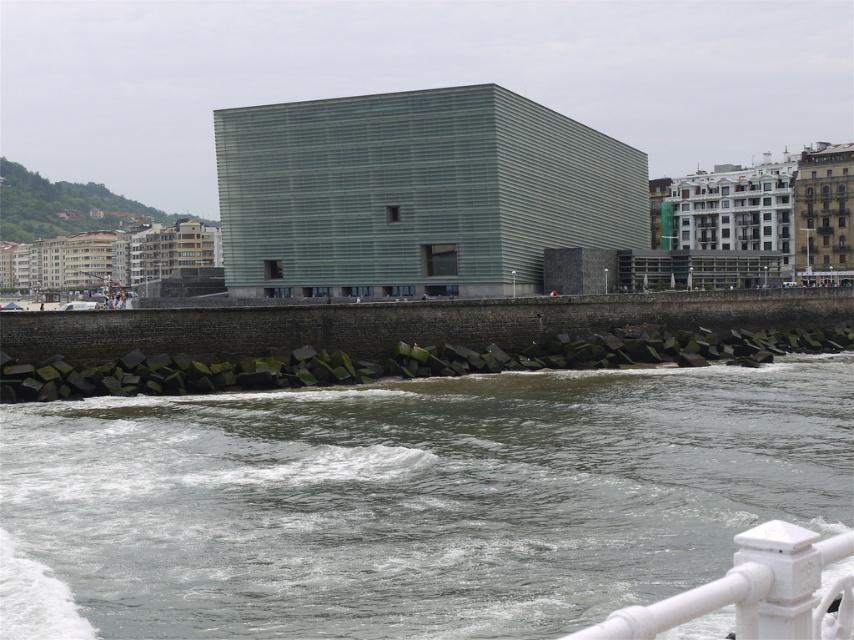
Question: Which point is farther to the camera?

Choices:
 (A) dark gray water at lower center
 (B) white painted metal railing at lower right

Answer: (A)

Question: Is dark gray water at lower center closer to the viewer compared to white painted metal railing at lower right?

Choices:
 (A) no
 (B) yes

Answer: (A)

Question: Which point is closer to the camera?

Choices:
 (A) white painted metal railing at lower right
 (B) dark gray water at lower center

Answer: (A)

Question: Is dark gray water at lower center wider than white painted metal railing at lower right?

Choices:
 (A) yes
 (B) no

Answer: (A)

Question: Does dark gray water at lower center have a larger size compared to white painted metal railing at lower right?

Choices:
 (A) yes
 (B) no

Answer: (A)

Question: Among these objects, which one is nearest to the camera?

Choices:
 (A) white painted metal railing at lower right
 (B) dark gray water at lower center

Answer: (A)